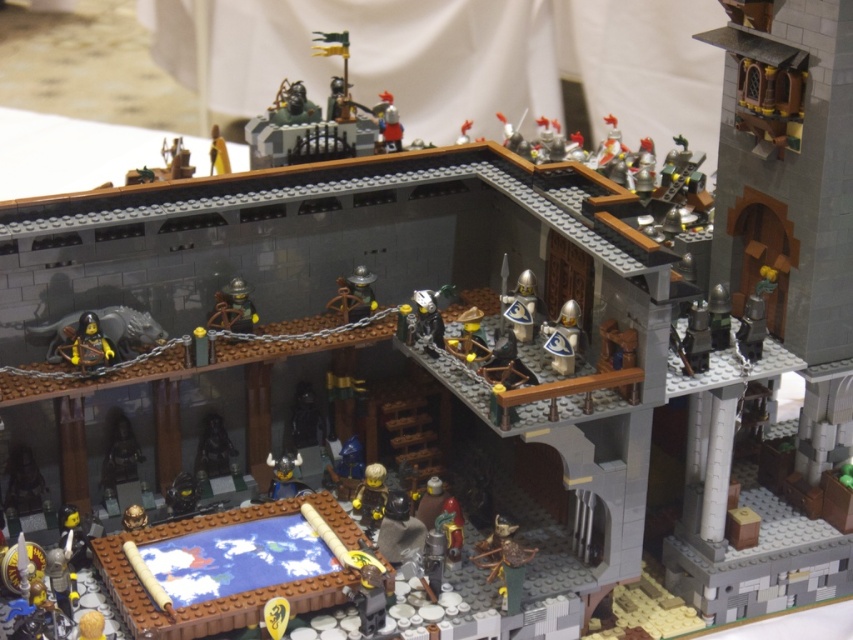
You are a visitor standing in front of the LEGO medieval castle. You notice two points marked in the scene. The first point is at coordinates point (216, 323) and the second is at point (207, 424). Which of these two points is closer to you?

Point (216, 323) is closer to the viewer than point (207, 424).